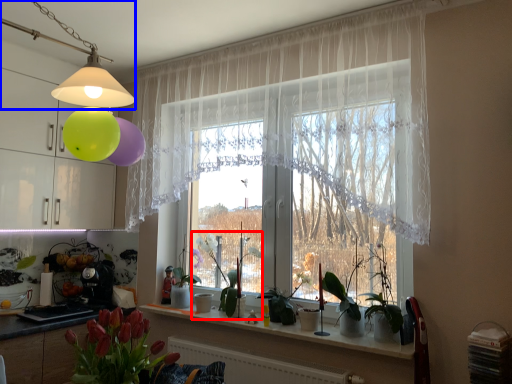
Question: Among these objects, which one is nearest to the camera, plant (highlighted by a red box) or lamp (highlighted by a blue box)?

Choices:
 (A) plant
 (B) lamp

Answer: (B)